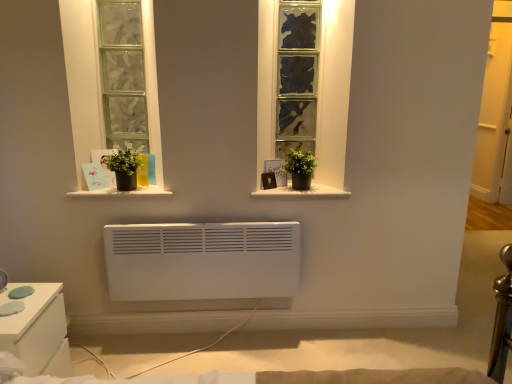
Question: Is textured glass window at center smaller than green matte plant pot at center, which is the first houseplant from right to left?

Choices:
 (A) yes
 (B) no

Answer: (B)

Question: From the image's perspective, is textured glass window at center beneath green matte plant pot at center, placed as the second houseplant when sorted from left to right?

Choices:
 (A) yes
 (B) no

Answer: (B)

Question: Considering the relative sizes of textured glass window at center and green matte plant pot at center, placed as the second houseplant when sorted from left to right, in the image provided, is textured glass window at center shorter than green matte plant pot at center, placed as the second houseplant when sorted from left to right,?

Choices:
 (A) yes
 (B) no

Answer: (B)

Question: Does textured glass window at center have a greater width compared to green matte plant pot at center, placed as the second houseplant when sorted from left to right?

Choices:
 (A) no
 (B) yes

Answer: (B)

Question: Can you confirm if textured glass window at center is bigger than green matte plant pot at center, placed as the second houseplant when sorted from left to right?

Choices:
 (A) no
 (B) yes

Answer: (B)

Question: In terms of width, does white glossy nightstand at lower left look wider or thinner when compared to green matte plant pot at center, placed as the second houseplant when sorted from left to right?

Choices:
 (A) thin
 (B) wide

Answer: (B)

Question: Is point (46, 299) positioned closer to the camera than point (291, 160)?

Choices:
 (A) farther
 (B) closer

Answer: (B)

Question: Based on their sizes in the image, would you say white glossy nightstand at lower left is bigger or smaller than green matte plant pot at center, which is the first houseplant from right to left?

Choices:
 (A) small
 (B) big

Answer: (B)

Question: Visually, is white glossy nightstand at lower left positioned to the left or to the right of green matte plant pot at center, placed as the second houseplant when sorted from left to right?

Choices:
 (A) right
 (B) left

Answer: (B)

Question: From a real-world perspective, is white matte window sill at center, placed as the 2th window sill when sorted from left to right, positioned above or below matte black pot at center, which is counted as the 1th window sill, starting from the left?

Choices:
 (A) above
 (B) below

Answer: (B)

Question: From the image's perspective, is white matte window sill at center, which is counted as the 1th window sill, starting from the right, located above or below matte black pot at center, which is counted as the 1th window sill, starting from the left?

Choices:
 (A) above
 (B) below

Answer: (A)

Question: Considering the positions of point (307, 193) and point (138, 188), is point (307, 193) closer or farther from the camera than point (138, 188)?

Choices:
 (A) farther
 (B) closer

Answer: (A)

Question: Is white matte window sill at center, which is counted as the 1th window sill, starting from the right, wider or thinner than matte black pot at center, acting as the 2th window sill starting from the right?

Choices:
 (A) thin
 (B) wide

Answer: (A)

Question: From a real-world perspective, is green matte plant pot at left, the first houseplant viewed from the left, above or below textured glass window at center?

Choices:
 (A) above
 (B) below

Answer: (B)

Question: Based on their positions, is green matte plant pot at left, which appears as the second houseplant when viewed from the right, located to the left or right of textured glass window at center?

Choices:
 (A) right
 (B) left

Answer: (B)